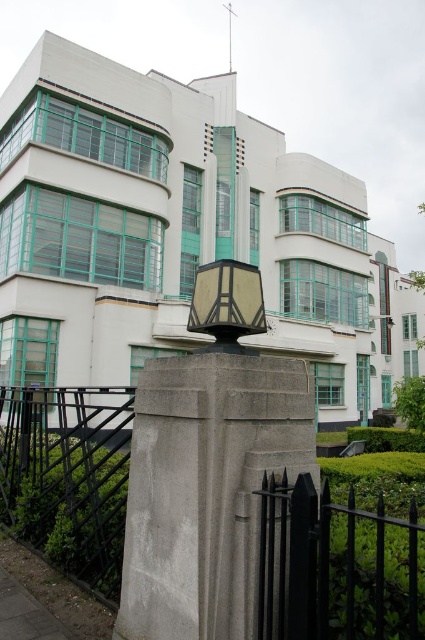
Question: Does black metal fence at lower center appear on the left side of green leafy hedge at lower left?

Choices:
 (A) no
 (B) yes

Answer: (B)

Question: Can you confirm if black metal fence at lower center is wider than matte beige lamp at center?

Choices:
 (A) yes
 (B) no

Answer: (A)

Question: Considering the relative positions of gray concrete pillar at center and matte beige lamp at center in the image provided, where is gray concrete pillar at center located with respect to matte beige lamp at center?

Choices:
 (A) left
 (B) right

Answer: (A)

Question: Which of the following is the closest to the observer?

Choices:
 (A) gray concrete pillar at center
 (B) black metal fence at lower center

Answer: (B)

Question: Which point appears closest to the camera in this image?

Choices:
 (A) [x=401, y=552]
 (B) [x=198, y=301]
 (C) [x=19, y=531]
 (D) [x=187, y=584]

Answer: (A)

Question: Based on their relative distances, which object is nearer to the black metal fence at lower center?

Choices:
 (A) green leafy hedge at lower left
 (B) matte beige lamp at center

Answer: (A)